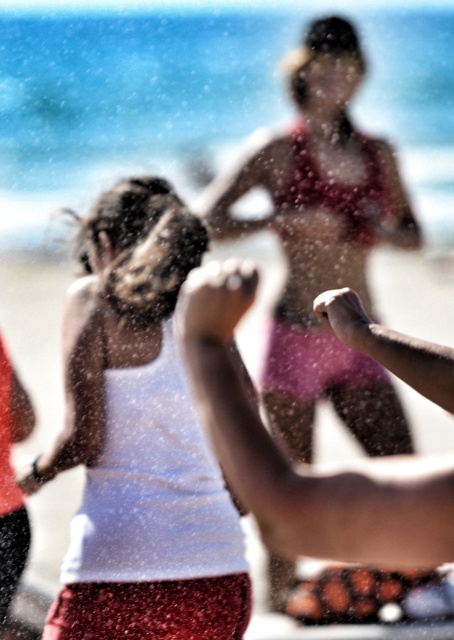
Which is above, clear water at center or white matte tank top at center?

clear water at center is above.

Can you confirm if clear water at center is positioned to the right of white matte tank top at center?

Incorrect, clear water at center is not on the right side of white matte tank top at center.

Which is in front, point (77, 177) or point (73, 531)?

Point (73, 531) is more forward.

Locate an element on the screen. clear water at center is located at coordinates (200, 92).

Which is above, white matte tank top at center or pink bikini at center?

pink bikini at center

From the picture: Is white matte tank top at center shorter than pink bikini at center?

Indeed, white matte tank top at center has a lesser height compared to pink bikini at center.

Locate an element on the screen. The width and height of the screenshot is (454, 640). white matte tank top at center is located at coordinates (139, 440).

Who is lower down, clear water at center or pink bikini at center?

Positioned lower is pink bikini at center.

Which is in front, point (418, 179) or point (310, 355)?

Point (310, 355) is more forward.

I want to click on clear water at center, so click(x=200, y=92).